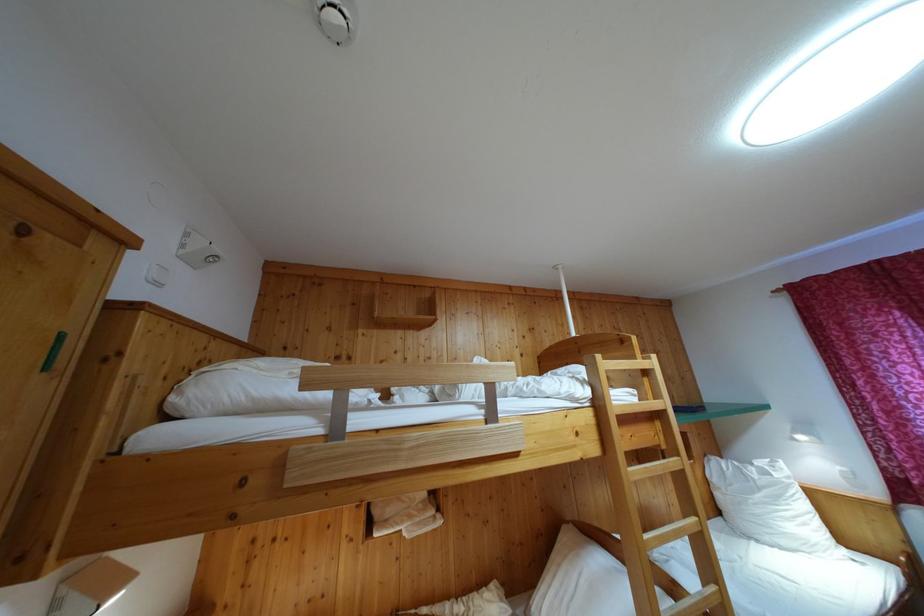
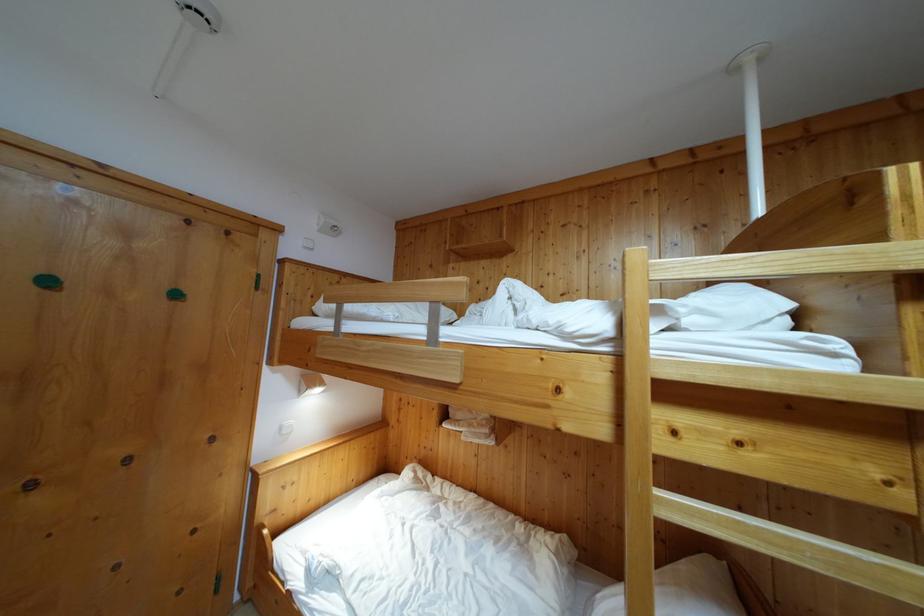
In the second image, find the point that corresponds to the point at 633,477 in the first image.

(663, 500)